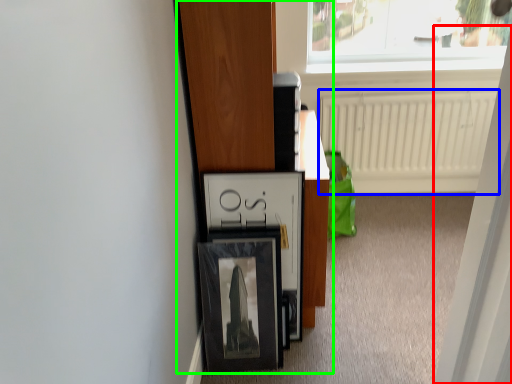
Question: Which is farther away from screen door (highlighted by a red box)? radiator (highlighted by a blue box) or furniture (highlighted by a green box)?

Choices:
 (A) radiator
 (B) furniture

Answer: (A)